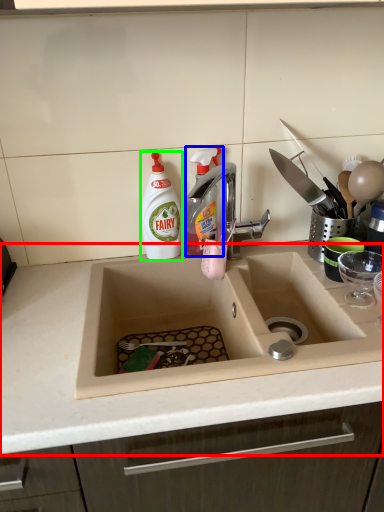
Question: Estimate the real-world distances between objects in this image. Which object is farther from countertop (highlighted by a red box), cleaning product (highlighted by a blue box) or cleaning product (highlighted by a green box)?

Choices:
 (A) cleaning product
 (B) cleaning product

Answer: (A)